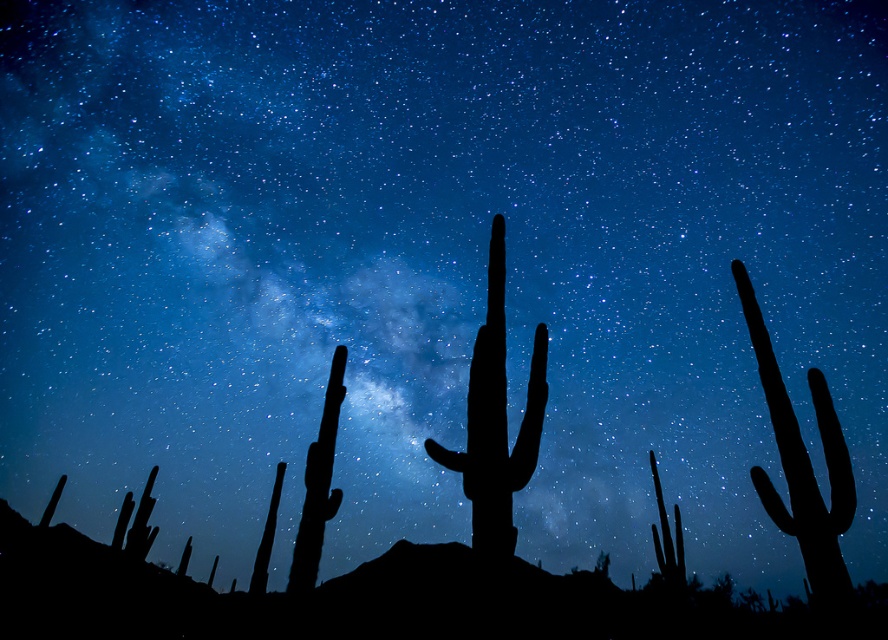
Question: Does black matte cactus at center have a smaller size compared to silhouette cactus at right?

Choices:
 (A) no
 (B) yes

Answer: (B)

Question: Which of the following is the farthest from the observer?

Choices:
 (A) (831, 461)
 (B) (536, 381)

Answer: (A)

Question: Does black matte cactus at center appear over silhouette cactus at right?

Choices:
 (A) no
 (B) yes

Answer: (B)

Question: Among these objects, which one is nearest to the camera?

Choices:
 (A) silhouette cactus at right
 (B) black matte cactus at center

Answer: (B)

Question: Which point is closer to the camera?

Choices:
 (A) silhouette cactus at right
 (B) black matte cactus at center

Answer: (B)

Question: Is black matte cactus at center smaller than silhouette cactus at right?

Choices:
 (A) yes
 (B) no

Answer: (A)